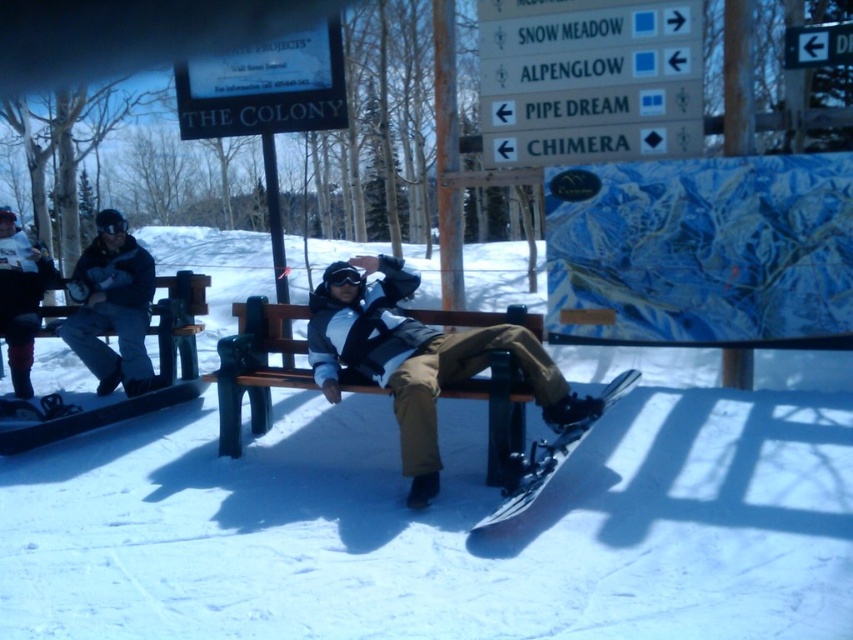
Question: Based on their relative distances, which object is nearer to the brown wooden bench at center?

Choices:
 (A) black matte snowboard at lower center
 (B) black matte snowboard at lower left
 (C) brushed metal snowboard at left

Answer: (B)

Question: Is black matte snowboard at lower center above black matte snowboard at lower left?

Choices:
 (A) no
 (B) yes

Answer: (A)

Question: Which of these objects is positioned farthest from the matte black snowboard at center?

Choices:
 (A) brown wooden bench at center
 (B) white matte snowboard at center

Answer: (B)

Question: Can you confirm if matte black snowboard at center is smaller than black matte snowboard at lower center?

Choices:
 (A) yes
 (B) no

Answer: (B)

Question: Observing the image, what is the correct spatial positioning of brushed metal snowboard at left in reference to black matte snowboard at lower center?

Choices:
 (A) right
 (B) left

Answer: (B)

Question: Which object appears farthest from the camera in this image?

Choices:
 (A) white matte snowboard at center
 (B) brushed metal snowboard at left
 (C) black matte snowboard at lower left

Answer: (B)